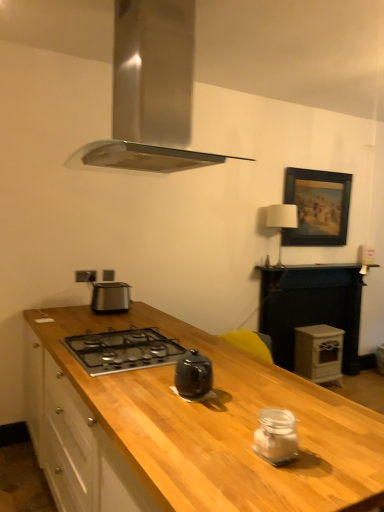
Find the location of a particular element. white matte wood stove at right is located at coordinates (318, 353).

Identify the location of wooden framed painting at upper right. Image resolution: width=384 pixels, height=512 pixels. (317, 207).

What do you see at coordinates (282, 221) in the screenshot?
I see `white fabric lampshade at upper right` at bounding box center [282, 221].

The width and height of the screenshot is (384, 512). Find the location of `wooden at center`. wooden at center is located at coordinates (223, 425).

Where is `wooden at right`? wooden at right is located at coordinates (310, 307).

Between stainless steel gas stove at center and white fabric lampshade at upper right, which one has larger size?

With larger size is white fabric lampshade at upper right.

Is stainless steel gas stove at center next to white fabric lampshade at upper right?

They are not placed beside each other.

From the image's perspective, is stainless steel gas stove at center over white fabric lampshade at upper right?

Actually, stainless steel gas stove at center appears below white fabric lampshade at upper right in the image.

Is wooden framed painting at upper right facing away from wooden at right?

No, wooden framed painting at upper right is not facing the opposite direction of wooden at right.

Considering the relative positions of wooden framed painting at upper right and wooden at right in the image provided, is wooden framed painting at upper right to the right of wooden at right from the viewer's perspective?

No, wooden framed painting at upper right is not to the right of wooden at right.

From the image's perspective, is wooden framed painting at upper right beneath wooden at right?

No, from the image's perspective, wooden framed painting at upper right is not beneath wooden at right.

Where is `counter top in front of the wooden framed painting at upper right`? This screenshot has width=384, height=512. counter top in front of the wooden framed painting at upper right is located at coordinates (310, 307).

Which object is positioned more to the right, stainless steel gas stove at center or white matte wood stove at right?

white matte wood stove at right.

Can white matte wood stove at right be found inside stainless steel gas stove at center?

No, white matte wood stove at right is not a part of stainless steel gas stove at center.

How different are the orientations of stainless steel gas stove at center and white matte wood stove at right in degrees?

The facing directions of stainless steel gas stove at center and white matte wood stove at right are 90 degrees apart.

Which is in front, point (109, 312) or point (291, 433)?

Positioned in front is point (291, 433).

How far apart are satin silver toaster at center, acting as the 2th kitchen appliance starting from the front, and clear glass jar at center, arranged as the 2th kitchen appliance when viewed from the top?

5.58 feet.

Is clear glass jar at center, arranged as the 2th kitchen appliance when viewed from the top, surrounded by satin silver toaster at center, which is the second kitchen appliance from right to left?

That's incorrect, clear glass jar at center, arranged as the 2th kitchen appliance when viewed from the top, is not inside satin silver toaster at center, which is the second kitchen appliance from right to left.

Between satin silver toaster at center, the 2th kitchen appliance in the bottom-to-top sequence, and clear glass jar at center, which appears as the first kitchen appliance when viewed from the front, which one is positioned behind?

satin silver toaster at center, the 2th kitchen appliance in the bottom-to-top sequence, is behind.

Is clear glass jar at center, which is counted as the second kitchen appliance, starting from the left, to the left or to the right of white fabric lampshade at upper right in the image?

clear glass jar at center, which is counted as the second kitchen appliance, starting from the left, is to the left of white fabric lampshade at upper right.

Which of these two, clear glass jar at center, which is the 2th kitchen appliance from back to front, or white fabric lampshade at upper right, is thinner?

clear glass jar at center, which is the 2th kitchen appliance from back to front.

Is clear glass jar at center, which is the 2th kitchen appliance from back to front, in contact with white fabric lampshade at upper right?

No, clear glass jar at center, which is the 2th kitchen appliance from back to front, is not with white fabric lampshade at upper right.

Can you confirm if wooden at right is positioned to the right of white matte wood stove at right?

No.

How far apart are wooden at right and white matte wood stove at right?

A distance of 27.75 centimeters exists between wooden at right and white matte wood stove at right.

Is wooden at right in contact with white matte wood stove at right?

No, wooden at right is not next to white matte wood stove at right.

How different are the orientations of wooden at right and white matte wood stove at right in degrees?

The facing directions of wooden at right and white matte wood stove at right are 0.402 degrees apart.

This screenshot has height=512, width=384. In the image, there is a white fabric lampshade at upper right. Find the location of `counter top below it (from a real-world perspective)`. counter top below it (from a real-world perspective) is located at coordinates (310, 307).

Between white fabric lampshade at upper right and wooden at right, which one has more height?

wooden at right is taller.

Would you say wooden at right is part of white fabric lampshade at upper right's contents?

No, wooden at right is located outside of white fabric lampshade at upper right.

Where is `lamp above the stainless steel gas stove at center (from a real-world perspective)`? This screenshot has width=384, height=512. lamp above the stainless steel gas stove at center (from a real-world perspective) is located at coordinates (282, 221).

Find the location of `picture frame located on the left of wooden at right`. picture frame located on the left of wooden at right is located at coordinates (317, 207).

Based on their spatial positions, is white fabric lampshade at upper right or wooden framed painting at upper right further from white matte wood stove at right?

wooden framed painting at upper right lies further to white matte wood stove at right than the other object.

Looking at the image, which one is located closer to stainless steel range hood at upper center, white fabric lampshade at upper right or wooden at center?

wooden at center.

Which object lies nearer to the anchor point wooden at center, satin silver toaster at center, which is the second kitchen appliance from right to left, or wooden framed painting at upper right?

The object closer to wooden at center is satin silver toaster at center, which is the second kitchen appliance from right to left.

From the image, which object appears to be nearer to stainless steel gas stove at center, white fabric lampshade at upper right or wooden at center?

The object closer to stainless steel gas stove at center is wooden at center.

From the picture: Looking at the image, which one is located further to wooden at center, satin silver toaster at center, placed as the first kitchen appliance when sorted from left to right, or white matte wood stove at right?

white matte wood stove at right is further to wooden at center.

Based on their spatial positions, is stainless steel gas stove at center or satin silver outlet at lower left closer to white matte wood stove at right?

satin silver outlet at lower left is positioned closer to the anchor white matte wood stove at right.

Which object lies nearer to the anchor point stainless steel range hood at upper center, wooden at center or stainless steel gas stove at center?

stainless steel gas stove at center is positioned closer to the anchor stainless steel range hood at upper center.

Considering their positions, is stainless steel gas stove at center positioned closer to wooden framed painting at upper right than stainless steel range hood at upper center?

stainless steel range hood at upper center is closer to wooden framed painting at upper right.

You are a GUI agent. You are given a task and a screenshot of the screen. Output one action in this format:
    pyautogui.click(x=<x>, y=<y>)
    Task: Click on the kitchen appliance between wooden at center and satin silver toaster at center, arranged as the first kitchen appliance when viewed from the back, from front to back
    The width and height of the screenshot is (384, 512).
    Given the screenshot: What is the action you would take?
    pyautogui.click(x=276, y=436)

The width and height of the screenshot is (384, 512). What are the coordinates of `gas stove located between clear glass jar at center, which ranks as the 1th kitchen appliance in bottom-to-top order, and satin silver toaster at center, placed as the first kitchen appliance when sorted from left to right, in the depth direction` in the screenshot? It's located at (123, 350).

You are a GUI agent. You are given a task and a screenshot of the screen. Output one action in this format:
    pyautogui.click(x=<x>, y=<y>)
    Task: Click on the gas stove between stainless steel range hood at upper center and wooden framed painting at upper right along the z-axis
    The height and width of the screenshot is (512, 384).
    Given the screenshot: What is the action you would take?
    pyautogui.click(x=123, y=350)

The image size is (384, 512). In order to click on kitchen appliance located between stainless steel gas stove at center and satin silver outlet at lower left in the depth direction in this screenshot , I will do `click(110, 297)`.